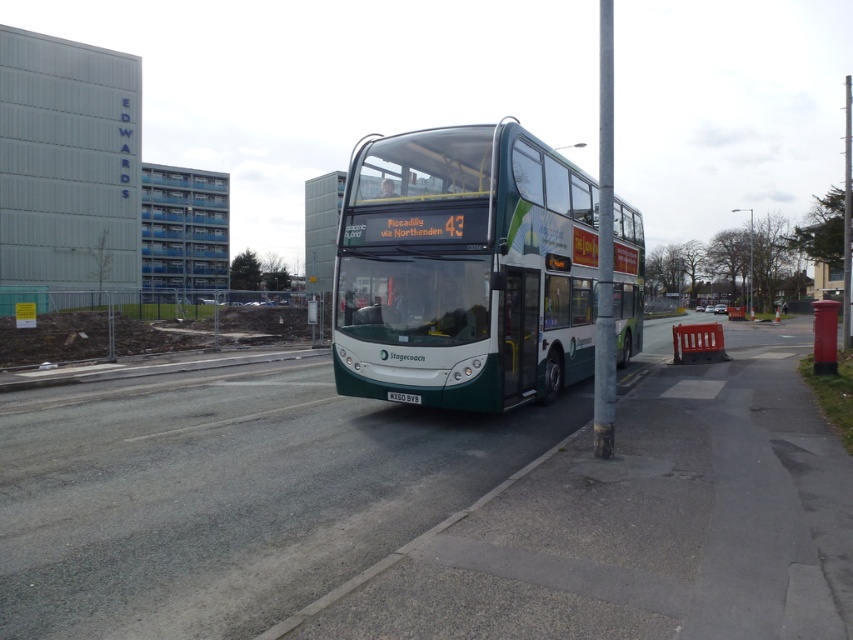
You are standing on the sidewalk to the right of the bus. You see a point marked at coordinates (x=463, y=269). What object is located at that point?

The point at coordinates (x=463, y=269) corresponds to the green matte bus at center.